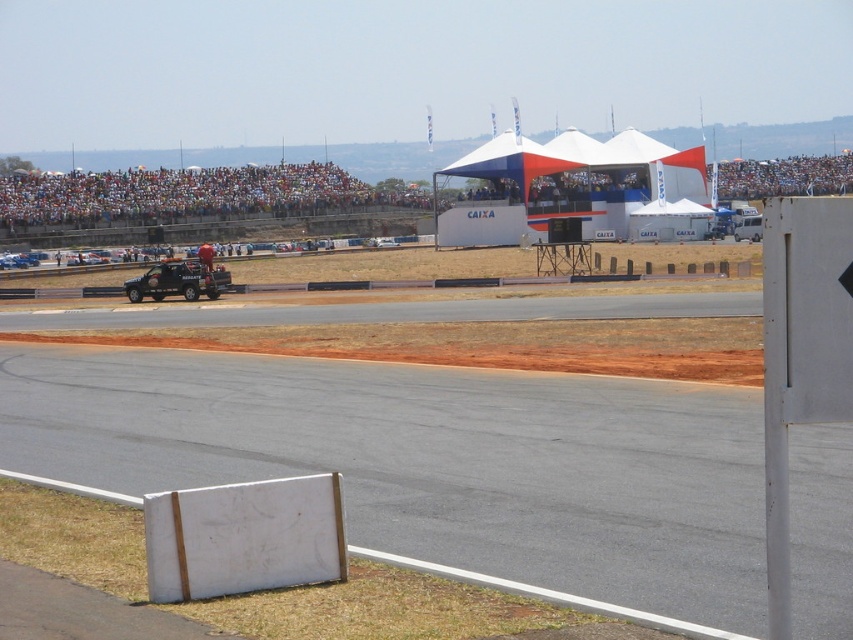
Question: From the image, what is the correct spatial relationship of white smooth board at center in relation to matte black suv at center?

Choices:
 (A) below
 (B) above

Answer: (A)

Question: Which object appears closest to the camera in this image?

Choices:
 (A) multicolored fabric crowd at upper center
 (B) white smooth board at center

Answer: (B)

Question: Which object is the closest to the matte black suv at center?

Choices:
 (A) multicolored fabric crowd at upper center
 (B) white smooth board at center

Answer: (B)

Question: Does white smooth board at center have a greater width compared to matte black suv at center?

Choices:
 (A) yes
 (B) no

Answer: (A)

Question: Is multicolored fabric crowd at upper center above matte black suv at center?

Choices:
 (A) no
 (B) yes

Answer: (B)

Question: Which of the following is the farthest from the observer?

Choices:
 (A) multicolored fabric crowd at upper center
 (B) white smooth board at center
 (C) matte black suv at center

Answer: (A)